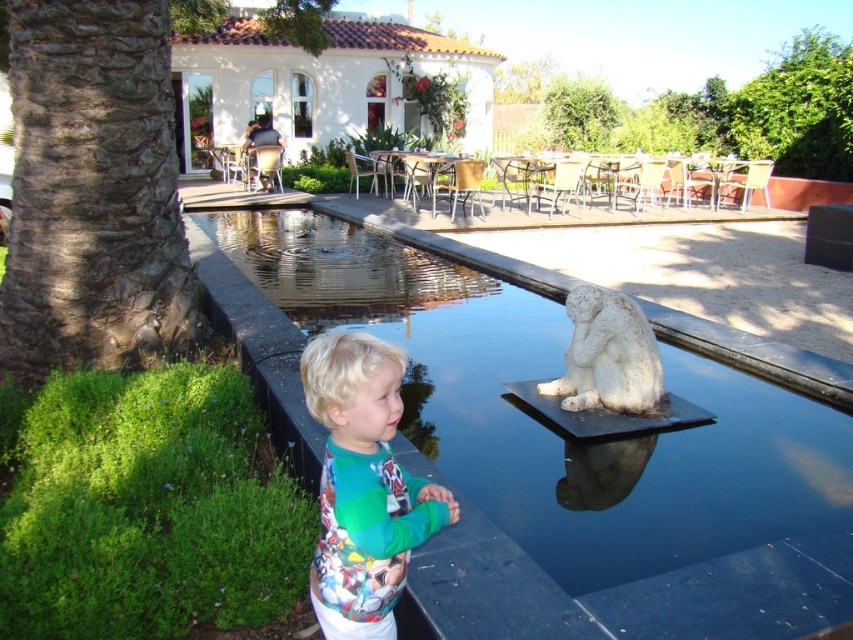
The height and width of the screenshot is (640, 853). In order to click on multicolored fleece sweater at lower left in this screenshot , I will do `click(363, 486)`.

Which is more to the right, multicolored fleece sweater at lower left or white stone statue at center?

white stone statue at center is more to the right.

This screenshot has height=640, width=853. Identify the location of multicolored fleece sweater at lower left. (363, 486).

Locate an element on the screen. Image resolution: width=853 pixels, height=640 pixels. multicolored fleece sweater at lower left is located at coordinates (x=363, y=486).

Between smooth concrete pool at center and white stone statue at center, which one has more height?

white stone statue at center is taller.

Can you confirm if smooth concrete pool at center is positioned below white stone statue at center?

Yes, smooth concrete pool at center is below white stone statue at center.

Which is in front, point (418, 589) or point (618, 292)?

Point (418, 589) is in front.

This screenshot has width=853, height=640. In order to click on smooth concrete pool at center in this screenshot , I will do `click(625, 593)`.

Which is above, smooth concrete pool at center or multicolored fleece sweater at lower left?

smooth concrete pool at center

Can you confirm if smooth concrete pool at center is shorter than multicolored fleece sweater at lower left?

Correct, smooth concrete pool at center is not as tall as multicolored fleece sweater at lower left.

Find the location of a particular element. This screenshot has height=640, width=853. smooth concrete pool at center is located at coordinates (625, 593).